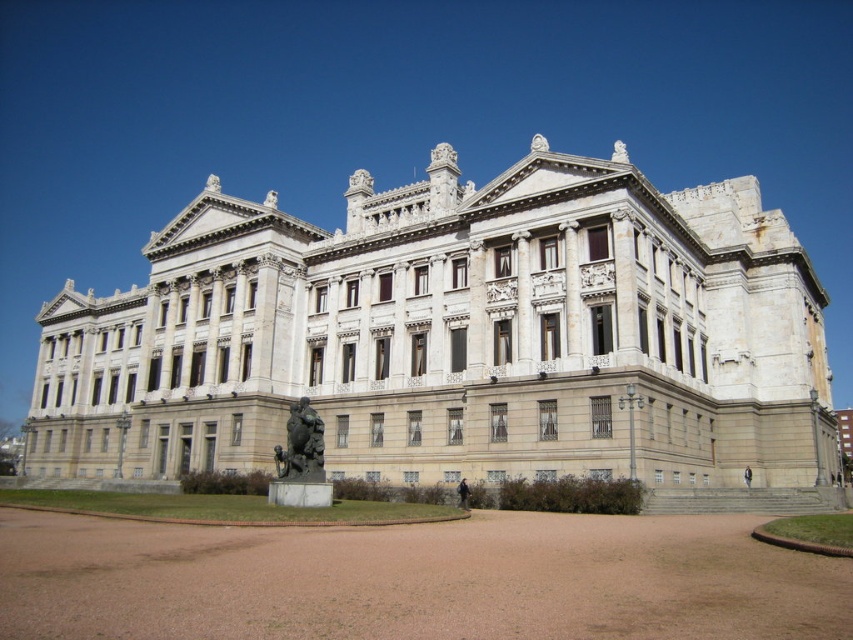
You are a visitor standing at the entrance of the white marble palace at center. You want to take a photo of the bronze statue at center. Which direction should you face to ensure the statue is in the frame?

The bronze statue at center is behind the white marble palace at center, so you should face away from the entrance towards the lawn area to take a photo of the bronze statue at center.